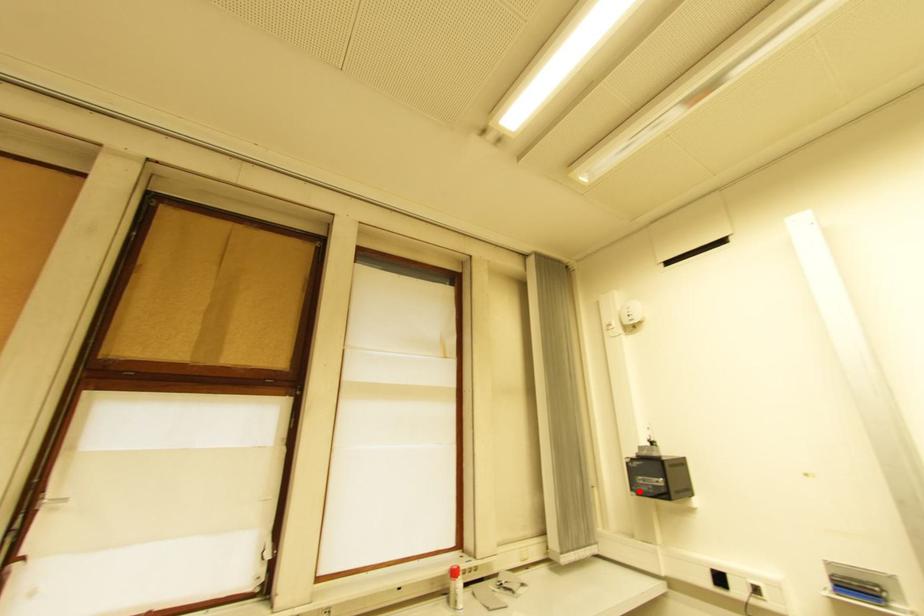
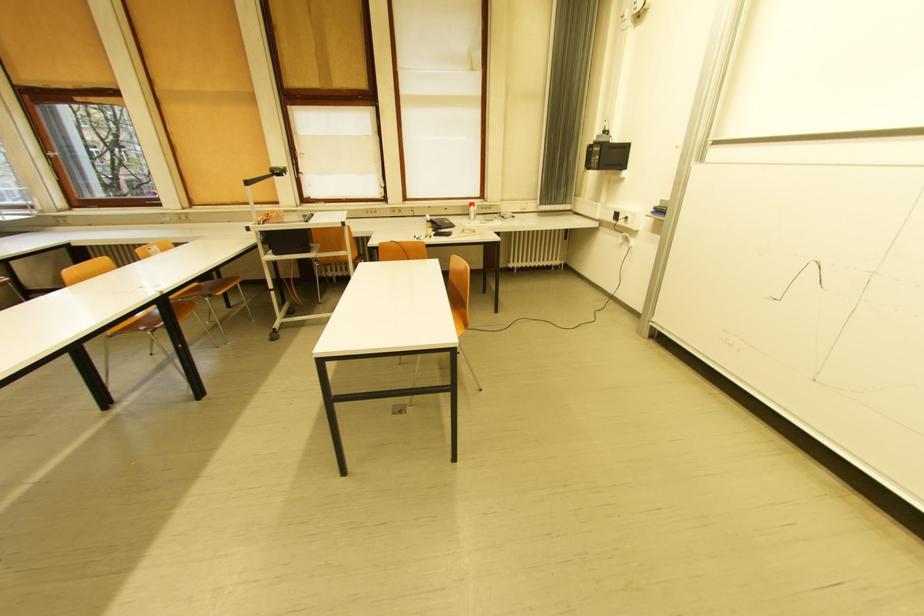
Find the pixel in the second image that matches the highlighted location in the first image.

(592, 168)